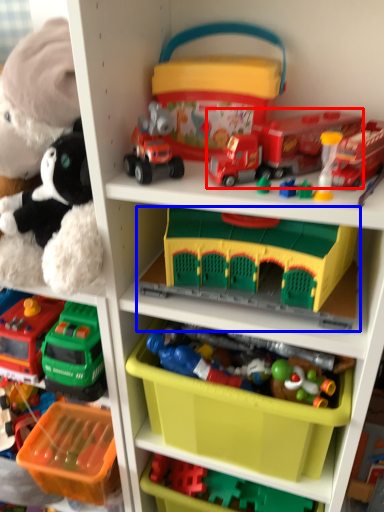
Question: Among these objects, which one is farthest to the camera, toy (highlighted by a red box) or toy (highlighted by a blue box)?

Choices:
 (A) toy
 (B) toy

Answer: (B)